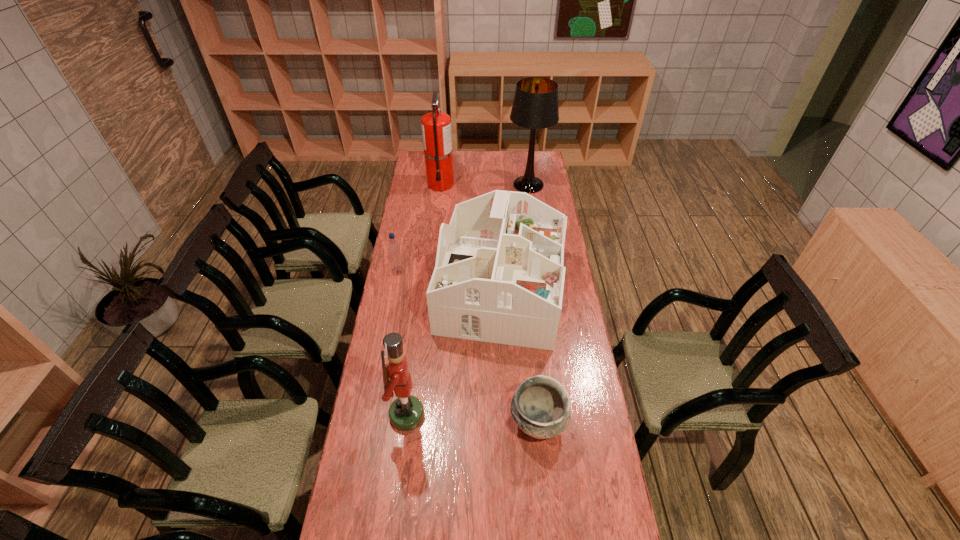
This screenshot has width=960, height=540. Find the location of `vacant space that satisfies the following two spatial constraints: 1. at the nozzle of the fire extinguisher; 2. on the front-facing side of the nutcracker`. vacant space that satisfies the following two spatial constraints: 1. at the nozzle of the fire extinguisher; 2. on the front-facing side of the nutcracker is located at coordinates (415, 415).

I want to click on free space that satisfies the following two spatial constraints: 1. at the nozzle of the fire extinguisher; 2. on the front-facing side of the nutcracker, so click(x=415, y=415).

Where is `free space that satisfies the following two spatial constraints: 1. at the nozzle of the fire extinguisher; 2. on the right side of the dollhouse`? This screenshot has width=960, height=540. free space that satisfies the following two spatial constraints: 1. at the nozzle of the fire extinguisher; 2. on the right side of the dollhouse is located at coordinates (429, 289).

The width and height of the screenshot is (960, 540). Find the location of `vacant space that satisfies the following two spatial constraints: 1. at the nozzle of the fire extinguisher; 2. on the front-facing side of the nutcracker`. vacant space that satisfies the following two spatial constraints: 1. at the nozzle of the fire extinguisher; 2. on the front-facing side of the nutcracker is located at coordinates (415, 415).

You are a GUI agent. You are given a task and a screenshot of the screen. Output one action in this format:
    pyautogui.click(x=<x>, y=<y>)
    Task: Click on the free location that satisfies the following two spatial constraints: 1. on the back side of the fifth tallest object; 2. on the right side of the table lamp
    Image resolution: width=960 pixels, height=540 pixels.
    Given the screenshot: What is the action you would take?
    pyautogui.click(x=414, y=185)

Locate an element on the screen. vacant space that satisfies the following two spatial constraints: 1. at the nozzle of the fire extinguisher; 2. on the front-facing side of the nutcracker is located at coordinates (415, 415).

Where is `blank space that satisfies the following two spatial constraints: 1. on the front side of the table lamp; 2. on the front-facing side of the nutcracker`? blank space that satisfies the following two spatial constraints: 1. on the front side of the table lamp; 2. on the front-facing side of the nutcracker is located at coordinates (561, 415).